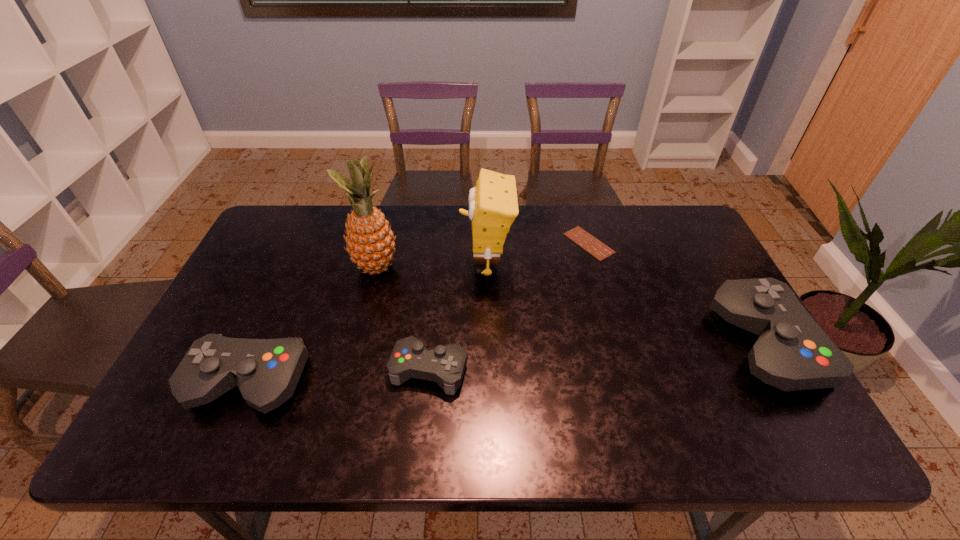
This screenshot has height=540, width=960. I want to click on vacant area that lies between the shortest control and the leftmost object, so [339, 376].

You are a GUI agent. You are given a task and a screenshot of the screen. Output one action in this format:
    pyautogui.click(x=<x>, y=<y>)
    Task: Click on the free space between the shortest object and the rightmost object
    
    Given the screenshot: What is the action you would take?
    pyautogui.click(x=677, y=294)

You are a GUI agent. You are given a task and a screenshot of the screen. Output one action in this format:
    pyautogui.click(x=<x>, y=<y>)
    Task: Click on the free point between the shortest object and the second control from right to left
    The image size is (960, 540).
    Given the screenshot: What is the action you would take?
    pyautogui.click(x=509, y=306)

Locate an element on the screen. empty location between the fifth object from left to right and the shortest control is located at coordinates (509, 306).

You are a GUI agent. You are given a task and a screenshot of the screen. Output one action in this format:
    pyautogui.click(x=<x>, y=<y>)
    Task: Click on the free spot between the second object from right to left and the rightmost control
    
    Given the screenshot: What is the action you would take?
    pyautogui.click(x=677, y=294)

The height and width of the screenshot is (540, 960). In order to click on vacant space that's between the fifth object from right to left and the leftmost object in this screenshot , I will do coord(312,326).

Locate an element on the screen. unoccupied area between the second tallest object and the fifth object from left to right is located at coordinates (538, 253).

You are a GUI agent. You are given a task and a screenshot of the screen. Output one action in this format:
    pyautogui.click(x=<x>, y=<y>)
    Task: Click on the object that is the fifth nearest to the rightmost object
    The image size is (960, 540).
    Given the screenshot: What is the action you would take?
    pyautogui.click(x=266, y=371)

Identify which object is the second nearest to the second tallest object. Please provide its 2D coordinates. Your answer should be formatted as a tuple, i.e. [(x, y)], where the tuple contains the x and y coordinates of a point satisfying the conditions above.

[(370, 242)]

I want to click on control that is the second closest to the shortest control, so click(x=792, y=353).